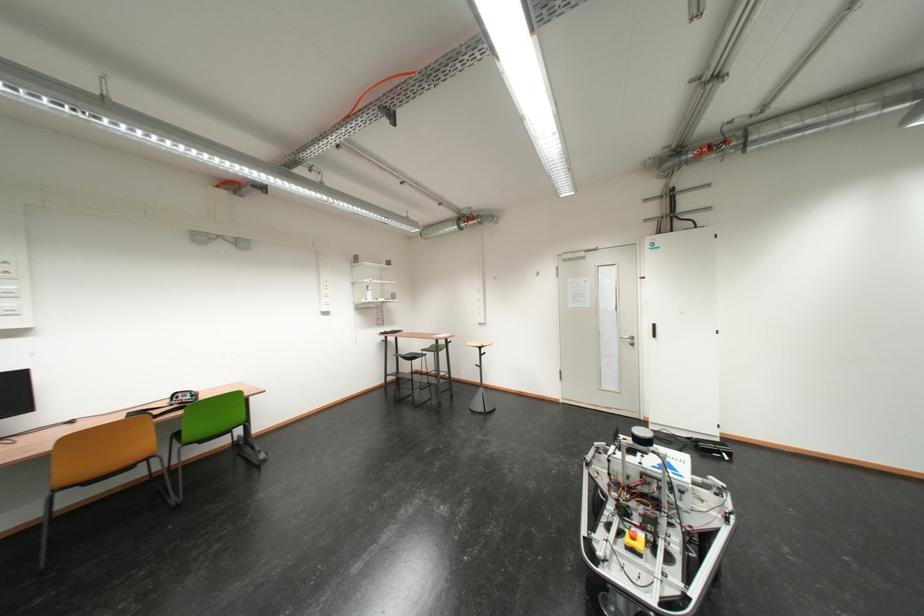
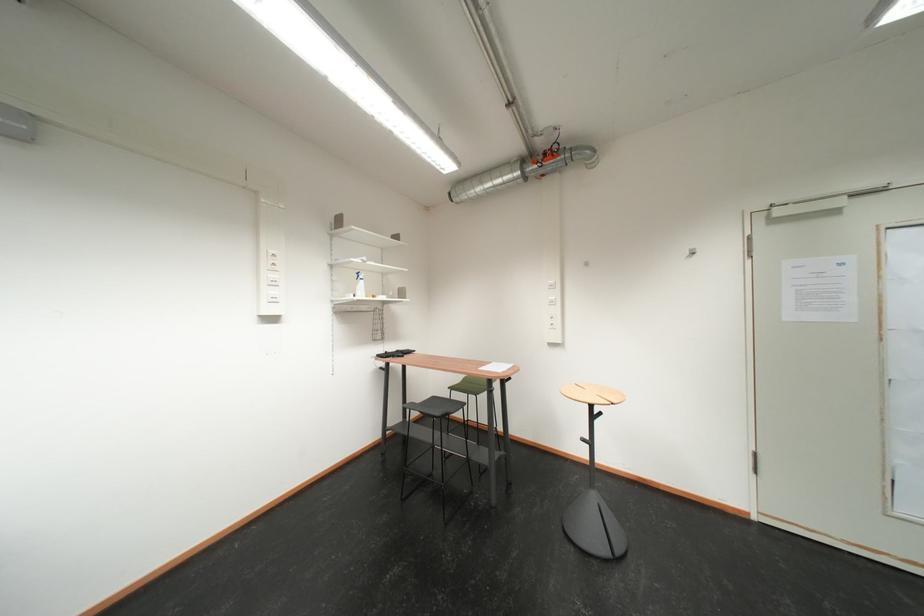
Find the pixel in the second image that matches (x=477, y=223) in the first image.

(552, 160)